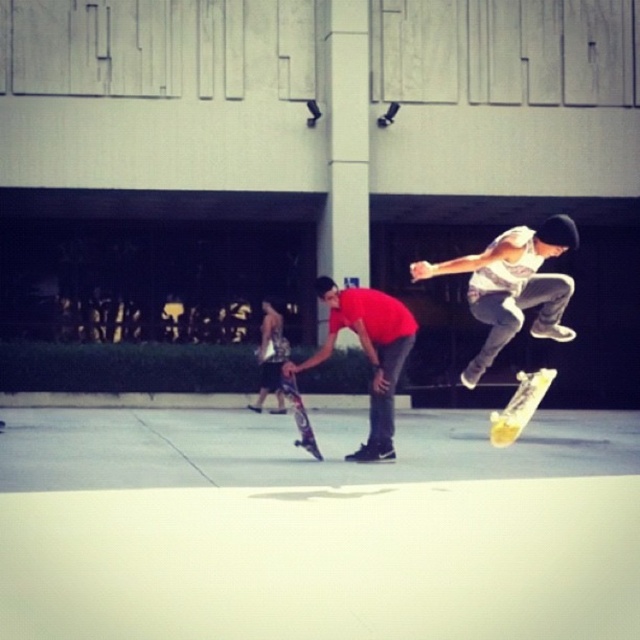
Question: Estimate the real-world distances between objects in this image. Which object is farther from the white cotton tank top at upper right?

Choices:
 (A) shiny purple skateboard at center
 (B) matte red shirt at center
 (C) yellow wooden skateboard at center

Answer: (A)

Question: Is yellow wooden skateboard at center below shiny purple skateboard at center?

Choices:
 (A) no
 (B) yes

Answer: (B)

Question: Does matte red shirt at center appear on the left side of yellow wooden skateboard at center?

Choices:
 (A) yes
 (B) no

Answer: (A)

Question: Which object is closer to the camera taking this photo?

Choices:
 (A) matte red shirt at center
 (B) yellow wooden skateboard at center
 (C) shiny purple skateboard at center

Answer: (B)

Question: Which is nearer to the matte red shirt at center?

Choices:
 (A) yellow wooden skateboard at center
 (B) white cotton tank top at upper right
 (C) shiny purple skateboard at center

Answer: (C)

Question: Can you confirm if white cotton tank top at upper right is thinner than yellow wooden skateboard at center?

Choices:
 (A) yes
 (B) no

Answer: (A)